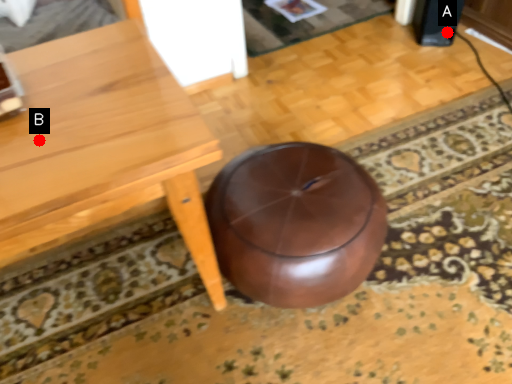
Question: Two points are circled on the image, labeled by A and B beside each circle. Which point is closer to the camera?

Choices:
 (A) A is closer
 (B) B is closer

Answer: (B)